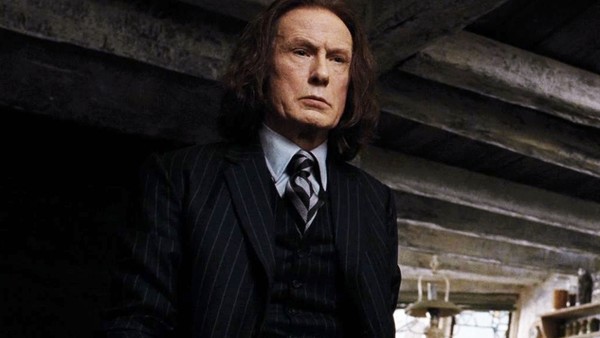
Locate an element on the screen. The height and width of the screenshot is (338, 600). window is located at coordinates (480, 318).